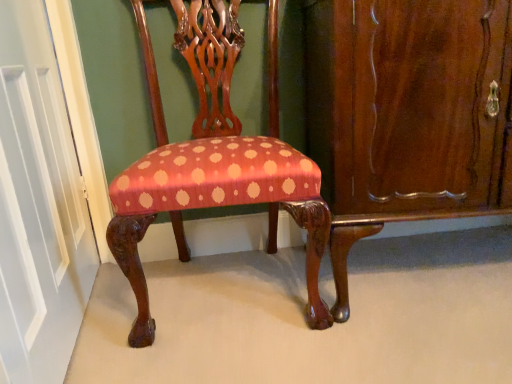
Question: Based on their sizes in the image, would you say mahogany wood dresser at right is bigger or smaller than silky red fabric chair at center?

Choices:
 (A) big
 (B) small

Answer: (A)

Question: Considering the positions of mahogany wood dresser at right and silky red fabric chair at center in the image, is mahogany wood dresser at right wider or thinner than silky red fabric chair at center?

Choices:
 (A) thin
 (B) wide

Answer: (B)

Question: Which object is positioned closest to the white painted wood door at left?

Choices:
 (A) mahogany wood dresser at right
 (B) silky red fabric chair at center

Answer: (B)

Question: Which is farther from the white painted wood door at left?

Choices:
 (A) silky red fabric chair at center
 (B) mahogany wood dresser at right

Answer: (B)